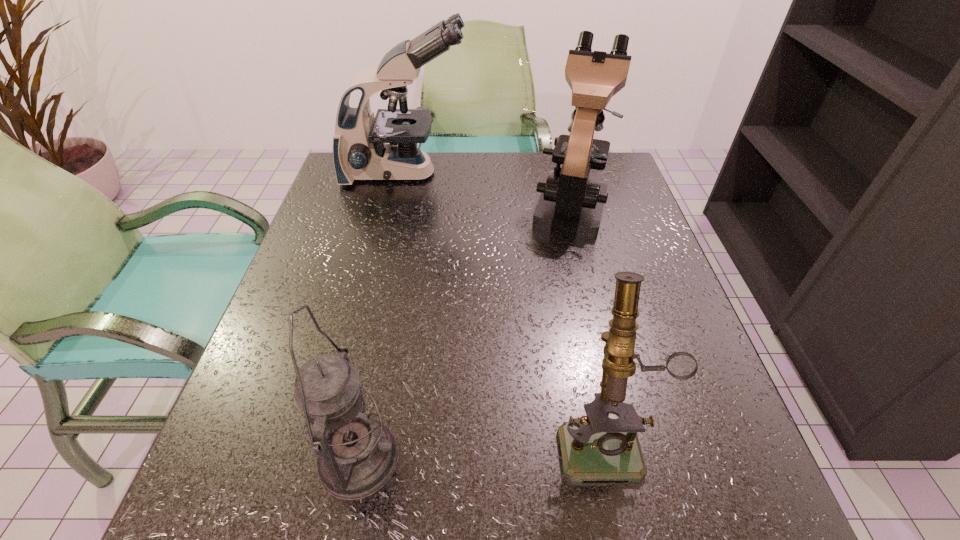
You are a GUI agent. You are given a task and a screenshot of the screen. Output one action in this format:
    pyautogui.click(x=<x>, y=<y>)
    Task: Click on the free space between the oil lamp and the leftmost microscope
    This screenshot has height=540, width=960.
    Given the screenshot: What is the action you would take?
    point(382,316)

Image resolution: width=960 pixels, height=540 pixels. What are the coordinates of `free space between the oil lamp and the leftmost microscope` in the screenshot? It's located at (382, 316).

The width and height of the screenshot is (960, 540). I want to click on vacant area between the leftmost microscope and the oil lamp, so click(382, 316).

Identify which object is the third closest to the leftmost microscope. Please provide its 2D coordinates. Your answer should be formatted as a tuple, i.e. [(x, y)], where the tuple contains the x and y coordinates of a point satisfying the conditions above.

[(357, 455)]

Locate an element on the screen. object that is the second nearest to the leftmost microscope is located at coordinates (595, 447).

Locate an element on the screen. This screenshot has width=960, height=540. microscope that is the closest to the nearest microscope is located at coordinates (571, 205).

Identify the location of the third closest microscope to the oil lamp. Image resolution: width=960 pixels, height=540 pixels. (360, 152).

Find the location of a particular element. This screenshot has width=960, height=540. free point that satisfies the following two spatial constraints: 1. through the eyepieces of the oil lamp; 2. on the right side of the leftmost microscope is located at coordinates (342, 459).

Identify the location of free spot that satisfies the following two spatial constraints: 1. through the eyepieces of the leftmost microscope; 2. on the back side of the oil lamp. (342, 459).

Image resolution: width=960 pixels, height=540 pixels. I want to click on vacant space that satisfies the following two spatial constraints: 1. through the eyepieces of the oil lamp; 2. on the left side of the leftmost microscope, so click(x=342, y=459).